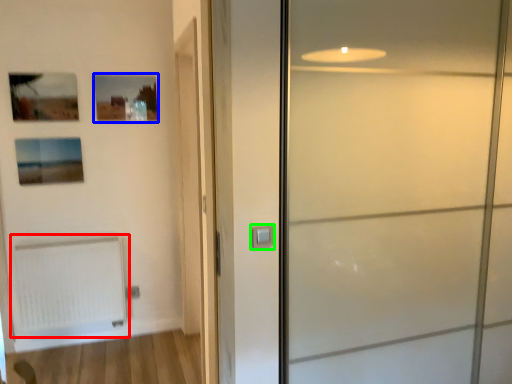
Question: Which object is positioned closest to radiator (highlighted by a red box)? Select from picture frame (highlighted by a blue box) and door handle (highlighted by a green box).

Choices:
 (A) picture frame
 (B) door handle

Answer: (A)